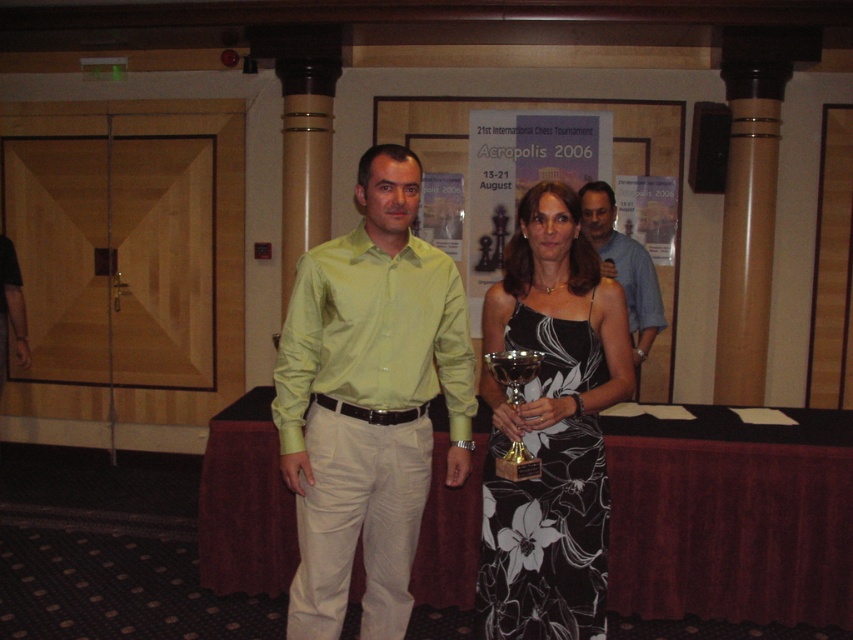
Between black floral dress at center and blue cotton shirt at center, which one appears on the right side from the viewer's perspective?

blue cotton shirt at center

Is point (563, 349) positioned after point (618, 266)?

That is False.

Identify the location of black floral dress at center. (544, 538).

Which is in front, point (592, 342) or point (589, 198)?

Point (592, 342) is more forward.

Is point (564, 321) farther from camera compared to point (601, 214)?

No, it is in front of (601, 214).

Where is `black floral dress at center`? The image size is (853, 640). black floral dress at center is located at coordinates (544, 538).

Does blue cotton shirt at center have a greater height compared to shiny silver trophy at center?

Yes.

Is point (646, 307) positioned after point (490, 364)?

Yes, point (646, 307) is behind point (490, 364).

The height and width of the screenshot is (640, 853). I want to click on blue cotton shirt at center, so click(x=635, y=280).